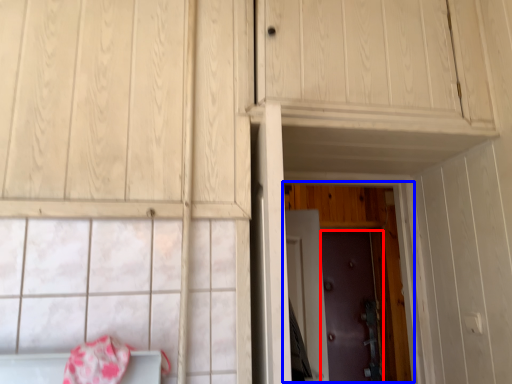
Question: Which point is further to the camera, door (highlighted by a red box) or door (highlighted by a blue box)?

Choices:
 (A) door
 (B) door

Answer: (A)